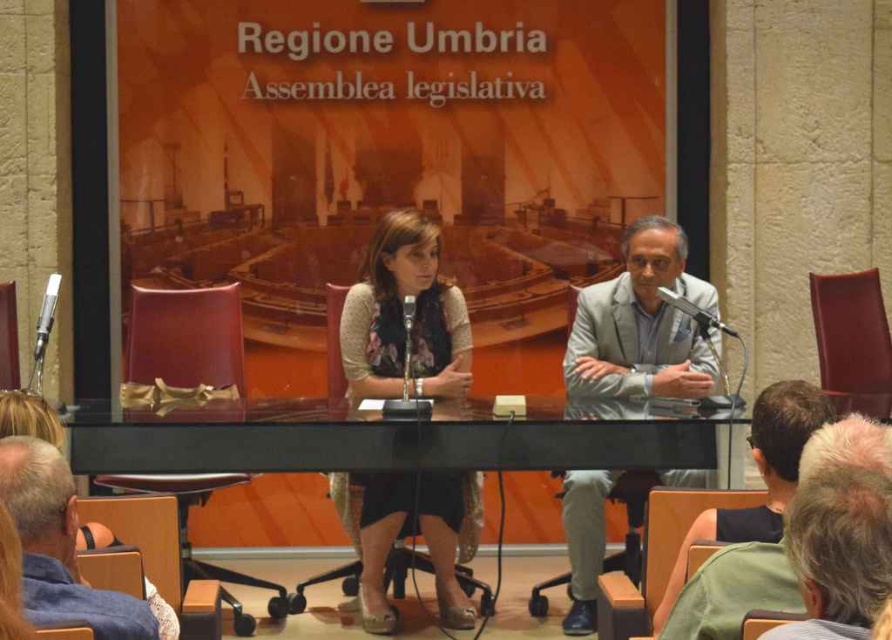
Question: Does floral-patterned blouse at center have a larger size compared to gray hair at lower right?

Choices:
 (A) yes
 (B) no

Answer: (A)

Question: Which point is closer to the camera taking this photo?

Choices:
 (A) tap(716, 317)
 (B) tap(772, 502)
 (C) tap(654, 328)

Answer: (B)

Question: Estimate the real-world distances between objects in this image. Which object is closer to the black plastic microphone at center?

Choices:
 (A) gray fabric chair at lower left
 (B) gray fabric suit at center
 (C) dark gray suit at center
 (D) metallic gray microphone at center

Answer: (B)

Question: Is gray fabric suit at center thinner than dark gray suit at center?

Choices:
 (A) no
 (B) yes

Answer: (A)

Question: Which point is closer to the camera?

Choices:
 (A) metallic silver microphone at left
 (B) gray hair at lower right
 (C) black glass table at center
 (D) gray fabric chair at lower left

Answer: (B)

Question: Is dark gray suit at center smaller than metallic gray microphone at center?

Choices:
 (A) yes
 (B) no

Answer: (B)